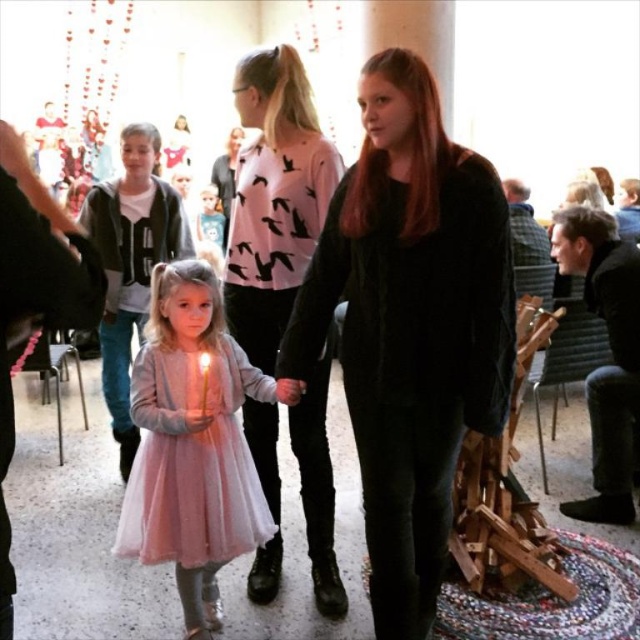
Is pastel pink tulle dress at center wider than light pink tulle dress at center?

Yes.

Who is more distant from viewer, (176, 548) or (218, 262)?

Point (218, 262)

Find the location of a particular element. The image size is (640, 640). pastel pink tulle dress at center is located at coordinates (193, 460).

Is black fuzzy coat at center to the right of light pink tulle dress at center from the viewer's perspective?

Yes, black fuzzy coat at center is to the right of light pink tulle dress at center.

Who is more forward, (365, 212) or (205, 208)?

Point (365, 212)

The width and height of the screenshot is (640, 640). What are the coordinates of `black fuzzy coat at center` in the screenshot? It's located at (410, 324).

Who is positioned more to the left, black fuzzy coat at center or pink matte sweater at center?

From the viewer's perspective, pink matte sweater at center appears more on the left side.

Does black fuzzy coat at center have a greater width compared to pink matte sweater at center?

Indeed, black fuzzy coat at center has a greater width compared to pink matte sweater at center.

The height and width of the screenshot is (640, 640). Find the location of `black fuzzy coat at center`. black fuzzy coat at center is located at coordinates (410, 324).